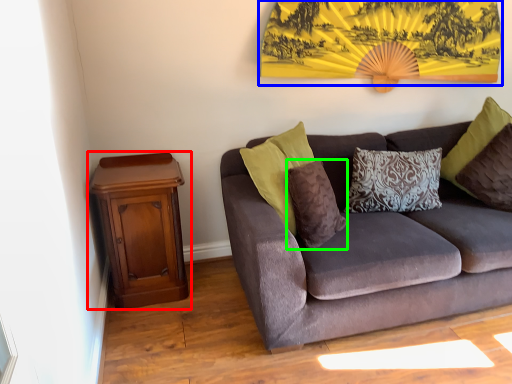
Question: Which is nearer to the nightstand (highlighted by a red box)? mountain view (highlighted by a blue box) or pillow (highlighted by a green box).

Choices:
 (A) mountain view
 (B) pillow

Answer: (B)